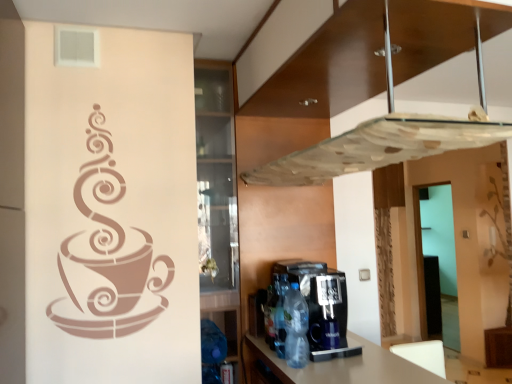
You are a GUI agent. You are given a task and a screenshot of the screen. Output one action in this format:
    pyautogui.click(x=<x>, y=<y>)
    Task: Click on the free space above transparent glass exhaust hood at upper center (from a real-world perspective)
    
    Given the screenshot: What is the action you would take?
    coord(368,69)